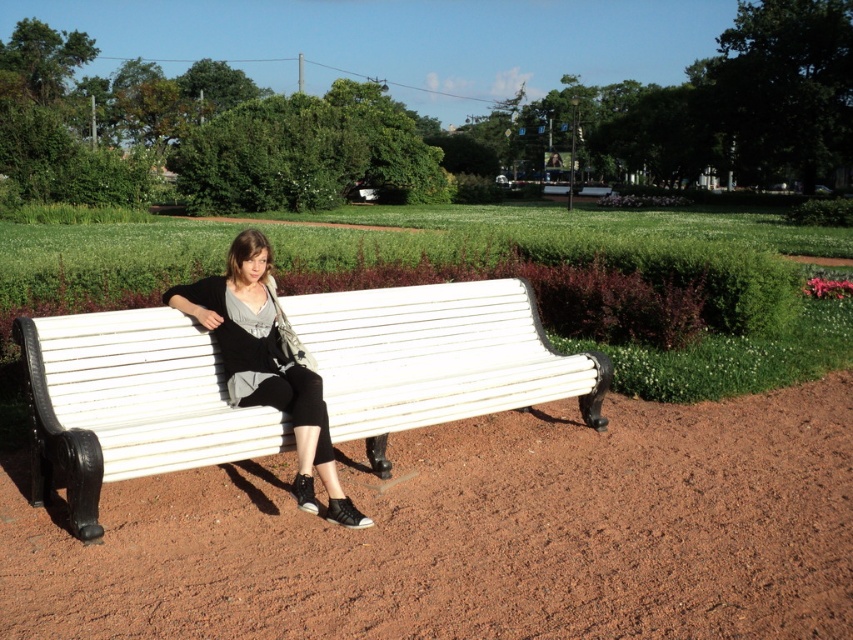
You are standing at the point with coordinates point (328, 483) and want to walk to the point with coordinates point (296, 301). Is the destination point behind you or in front of you?

The point (296, 301) is behind point (328, 483), so the destination point is behind you.

You are a park visitor who wants to sit on the white painted wood bench at center. However, you notice the matte black pants at center are already occupying part of the bench. Can you determine if there is enough space left on the bench for you to sit comfortably?

The white painted wood bench at center is located above the matte black pants at center, which means the pants are positioned lower on the bench. Since the bench extends beyond the area occupied by the pants, there should be enough space remaining for you to sit comfortably.

You are a park maintenance worker who needs to move the white painted wood bench at center and the matte black pants at center to different locations. Which object should you move first if you want to move the larger one first?

The white painted wood bench at center is bigger than the matte black pants at center, so you should move the white painted wood bench at center first.